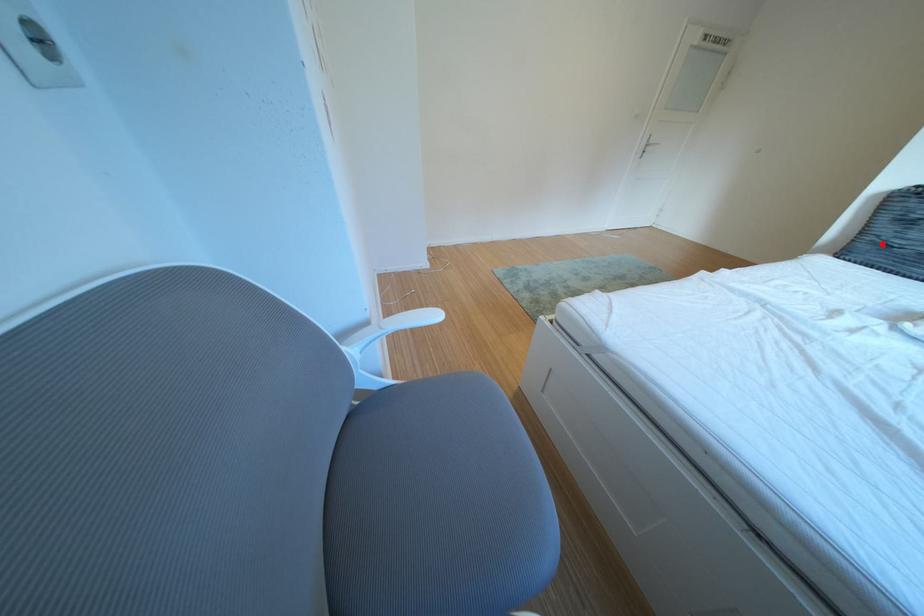
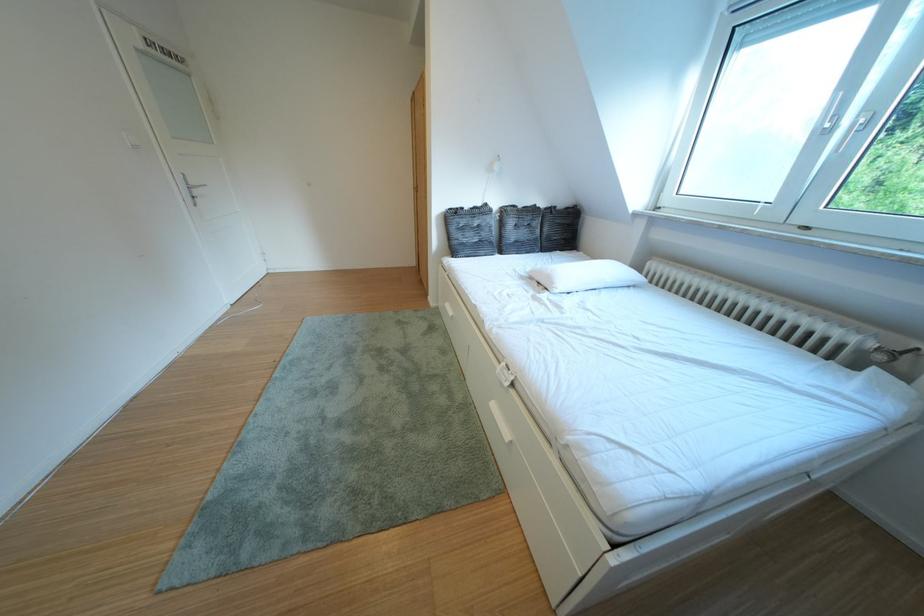
Locate, in the second image, the point that corresponds to the highlighted location in the first image.

(468, 246)